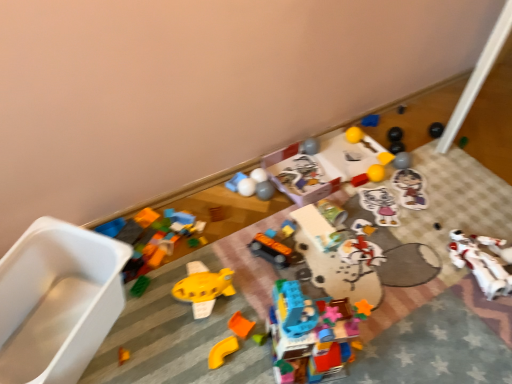
Find the location of `vacant space in between yellow matte toy boat at center, positioned as the second toy in left-to-right order, and translucent plastic building blocks at center, which ranks as the ninth toy in right-to-left order`. vacant space in between yellow matte toy boat at center, positioned as the second toy in left-to-right order, and translucent plastic building blocks at center, which ranks as the ninth toy in right-to-left order is located at coordinates (241, 325).